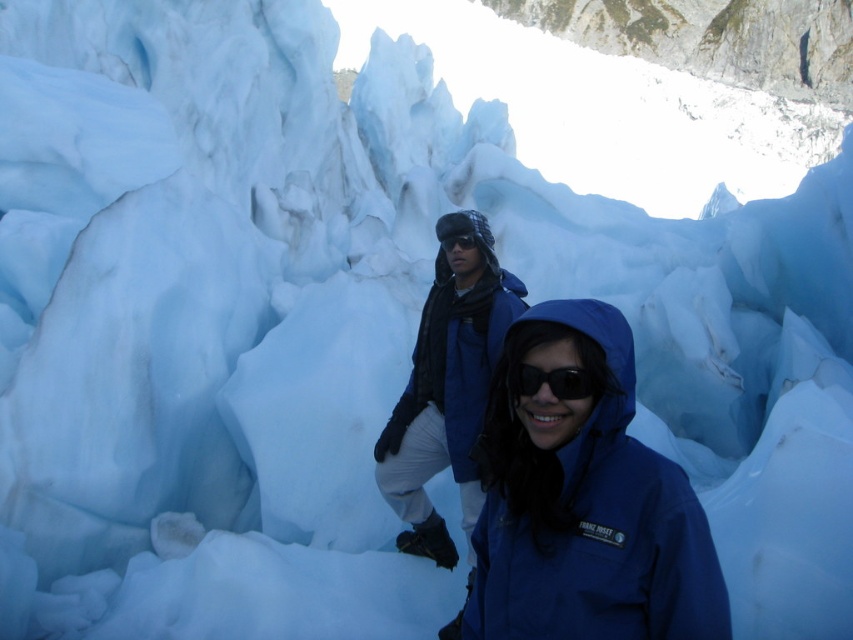
You are a photographer trying to capture the blue matte jacket at center in your shot. Based on the coordinates provided, where should you position your camera relative to the jacket to ensure it is centered in the frame?

The blue matte jacket at center is already positioned at the coordinates provided, so centering your camera directly on those coordinates will ensure the jacket is centered in the frame.

You are a photographer trying to capture a clear shot of the transparent plastic goggles at center. However, the matte blue jacket at center is blocking your view. Can you move the jacket to get a better angle?

The matte blue jacket at center is in front of the transparent plastic goggles at center, so moving the jacket would allow you to see the goggles clearly.

You are a photographer trying to capture a clear shot of the blue matte jacket at center. The camera you are using has a focal length of 50mm. Based on the coordinates provided, can you estimate if the jacket is within the camera frame?

The blue matte jacket at center is positioned at coordinates point (x=585, y=502), which falls within the camera frame when using a 50mm lens. Therefore, the jacket is within the frame and can be captured clearly.